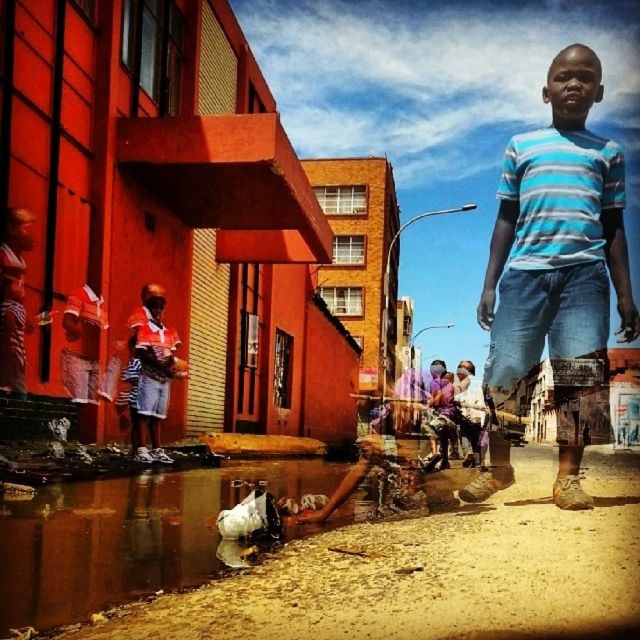
You are a delivery person who needs to place a package on the ground in this street scene. The package is too heavy to hold, so you must set it down carefully. Considering the objects present, where can you safely place the package without obstructing the brown plastic bag at lower center or the matte red shorts at lower left?

The safest place to set down the package would be away from both the brown plastic bag at lower center and the matte red shorts at lower left, ensuring it does not block their positions. Since the brown plastic bag is positioned under the matte red shorts, placing the package elsewhere in the scene would avoid obstruction.

You are a fashion designer observing the street scene. You notice the blue striped shirt at center and the matte red shorts at lower left. Which clothing item appears bigger in the image?

The blue striped shirt at center appears bigger than the matte red shorts at lower left in the image.